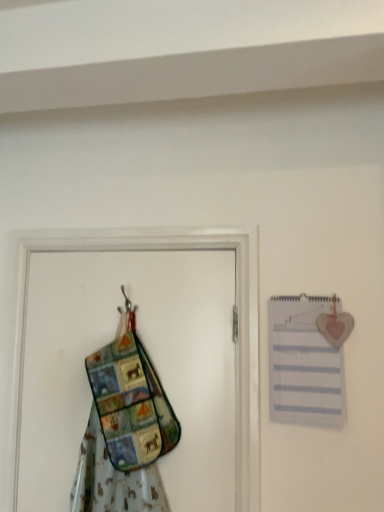
In order to click on multicolored fabric screen door at left in this screenshot , I will do `click(162, 250)`.

You are a GUI agent. You are given a task and a screenshot of the screen. Output one action in this format:
    pyautogui.click(x=<x>, y=<y>)
    Task: Click on the white paper journal at upper right
    
    Given the screenshot: What is the action you would take?
    306,361

From the image's perspective, which is below, multicolored fabric screen door at left or multicolored fabric apron at left?

multicolored fabric screen door at left appears lower in the image.

Does point (248, 464) lie in front of point (85, 441)?

Yes, it is in front of point (85, 441).

Which of these two, multicolored fabric screen door at left or multicolored fabric apron at left, is bigger?

With larger size is multicolored fabric screen door at left.

From the picture: Can you confirm if multicolored fabric screen door at left is thinner than multicolored fabric apron at left?

Yes.

Measure the distance between multicolored fabric apron at left and white paper journal at upper right.

The distance of multicolored fabric apron at left from white paper journal at upper right is 23.51 inches.

Considering the points (73, 483) and (313, 315), which point is behind, point (73, 483) or point (313, 315)?

The point (73, 483) is behind.

How different are the orientations of multicolored fabric apron at left and white paper journal at upper right in degrees?

The facing directions of multicolored fabric apron at left and white paper journal at upper right are 1.42 degrees apart.

Considering the sizes of multicolored fabric apron at left and white paper journal at upper right in the image, is multicolored fabric apron at left wider or thinner than white paper journal at upper right?

multicolored fabric apron at left is wider than white paper journal at upper right.

Does point (271, 308) come closer to viewer compared to point (126, 490)?

No.

Is white paper journal at upper right aimed at multicolored fabric apron at left?

No, white paper journal at upper right does not turn towards multicolored fabric apron at left.

From a real-world perspective, which object rests below the other?

From a 3D spatial view, multicolored fabric apron at left is below.

Is multicolored fabric apron at left a part of white paper journal at upper right?

No, multicolored fabric apron at left is not a part of white paper journal at upper right.

Can you confirm if multicolored fabric screen door at left is smaller than white paper journal at upper right?

No, multicolored fabric screen door at left is not smaller than white paper journal at upper right.

From a real-world perspective, is multicolored fabric screen door at left positioned over white paper journal at upper right based on gravity?

No, from a real-world perspective, multicolored fabric screen door at left is not on top of white paper journal at upper right.

In the scene shown: From the image's perspective, which one is positioned lower, multicolored fabric screen door at left or white paper journal at upper right?

multicolored fabric screen door at left appears lower in the image.

Looking at this image, which object is closer to the camera taking this photo, multicolored fabric screen door at left or white paper journal at upper right?

white paper journal at upper right is closer to the camera.

Would you say white paper journal at upper right is inside or outside multicolored fabric screen door at left?

white paper journal at upper right is spatially situated outside multicolored fabric screen door at left.

From the image's perspective, is white paper journal at upper right positioned above or below multicolored fabric screen door at left?

Based on their image positions, white paper journal at upper right is located above multicolored fabric screen door at left.

Measure the distance from white paper journal at upper right to multicolored fabric screen door at left.

white paper journal at upper right and multicolored fabric screen door at left are 22.01 centimeters apart.

From a real-world perspective, relative to multicolored fabric screen door at left, is white paper journal at upper right vertically above or below?

From a real-world perspective, white paper journal at upper right is physically above multicolored fabric screen door at left.

Which is nearer, (153, 475) or (244, 504)?

The point (244, 504) is closer.

From a real-world perspective, is multicolored fabric apron at left above or below multicolored fabric screen door at left?

multicolored fabric apron at left is below multicolored fabric screen door at left.

Can you confirm if multicolored fabric apron at left is bigger than multicolored fabric screen door at left?

No, multicolored fabric apron at left is not bigger than multicolored fabric screen door at left.

This screenshot has height=512, width=384. I want to click on fancy dress that appears in front of the multicolored fabric screen door at left, so pyautogui.click(x=112, y=480).

At what (x,y) coordinates should I click in order to perform the action: click on fancy dress below the white paper journal at upper right (from a real-world perspective). Please return your answer as a coordinate pair (x, y). This screenshot has height=512, width=384. Looking at the image, I should click on (112, 480).

When comparing their distances from multicolored fabric apron at left, does white paper journal at upper right or multicolored fabric screen door at left seem further?

white paper journal at upper right is positioned further to the anchor multicolored fabric apron at left.

Estimate the real-world distances between objects in this image. Which object is further from multicolored fabric screen door at left, white paper journal at upper right or multicolored fabric apron at left?

The object further to multicolored fabric screen door at left is multicolored fabric apron at left.

Considering their positions, is multicolored fabric apron at left positioned further to white paper journal at upper right than multicolored fabric screen door at left?

Among the two, multicolored fabric apron at left is located further to white paper journal at upper right.

In the scene shown: Which object lies further to the anchor point white paper journal at upper right, multicolored fabric screen door at left or multicolored fabric apron at left?

The object further to white paper journal at upper right is multicolored fabric apron at left.

From the image, which object appears to be farther from multicolored fabric apron at left, multicolored fabric screen door at left or white paper journal at upper right?

The object further to multicolored fabric apron at left is white paper journal at upper right.

Considering their positions, is multicolored fabric apron at left positioned further to multicolored fabric screen door at left than white paper journal at upper right?

multicolored fabric apron at left is positioned further to the anchor multicolored fabric screen door at left.

Locate an element on the screen. fancy dress situated between multicolored fabric screen door at left and white paper journal at upper right from left to right is located at coordinates (112, 480).